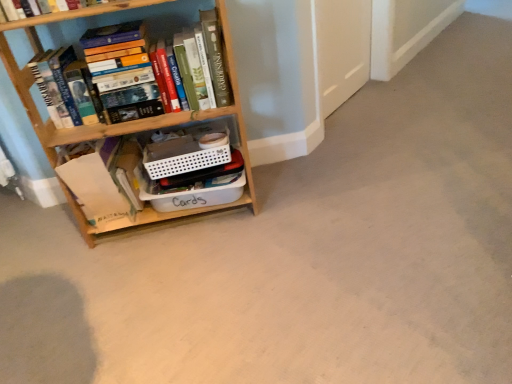
Question: Can you confirm if hardcover books at left, placed as the 2th book when sorted from bottom to top, is shorter than wooden bookcase at left?

Choices:
 (A) no
 (B) yes

Answer: (B)

Question: Could you tell me if hardcover books at left, which appears as the 1th book when viewed from the top, is facing wooden bookcase at left?

Choices:
 (A) no
 (B) yes

Answer: (B)

Question: Is hardcover books at left, which appears as the 1th book when viewed from the top, touching wooden bookcase at left?

Choices:
 (A) yes
 (B) no

Answer: (B)

Question: Is hardcover books at left, placed as the 2th book when sorted from bottom to top, taller than wooden bookcase at left?

Choices:
 (A) yes
 (B) no

Answer: (B)

Question: Is hardcover books at left, placed as the 2th book when sorted from bottom to top, positioned with its back to wooden bookcase at left?

Choices:
 (A) yes
 (B) no

Answer: (A)

Question: From the image's perspective, is hardcover books at left, placed as the 2th book when sorted from bottom to top, located beneath wooden bookcase at left?

Choices:
 (A) no
 (B) yes

Answer: (A)

Question: Considering the relative positions of hardcover books at left, placed as the 2th book when sorted from bottom to top, and white plastic container at center in the image provided, is hardcover books at left, placed as the 2th book when sorted from bottom to top, to the left of white plastic container at center from the viewer's perspective?

Choices:
 (A) no
 (B) yes

Answer: (B)

Question: From a real-world perspective, does hardcover books at left, which appears as the 1th book when viewed from the top, sit lower than white plastic container at center?

Choices:
 (A) yes
 (B) no

Answer: (B)

Question: Does hardcover books at left, which appears as the 1th book when viewed from the top, have a larger size compared to white plastic container at center?

Choices:
 (A) no
 (B) yes

Answer: (B)

Question: From a real-world perspective, is hardcover books at left, which appears as the 1th book when viewed from the top, located higher than white plastic container at center?

Choices:
 (A) yes
 (B) no

Answer: (A)

Question: Is white plastic container at center a part of hardcover books at left, which appears as the 1th book when viewed from the top?

Choices:
 (A) no
 (B) yes

Answer: (A)

Question: Is hardcover books at left, placed as the 2th book when sorted from bottom to top, located outside white plastic container at center?

Choices:
 (A) no
 (B) yes

Answer: (B)

Question: Is wooden bookcase at left thinner than hardcover books at left, which appears as the 1th book when viewed from the top?

Choices:
 (A) no
 (B) yes

Answer: (A)